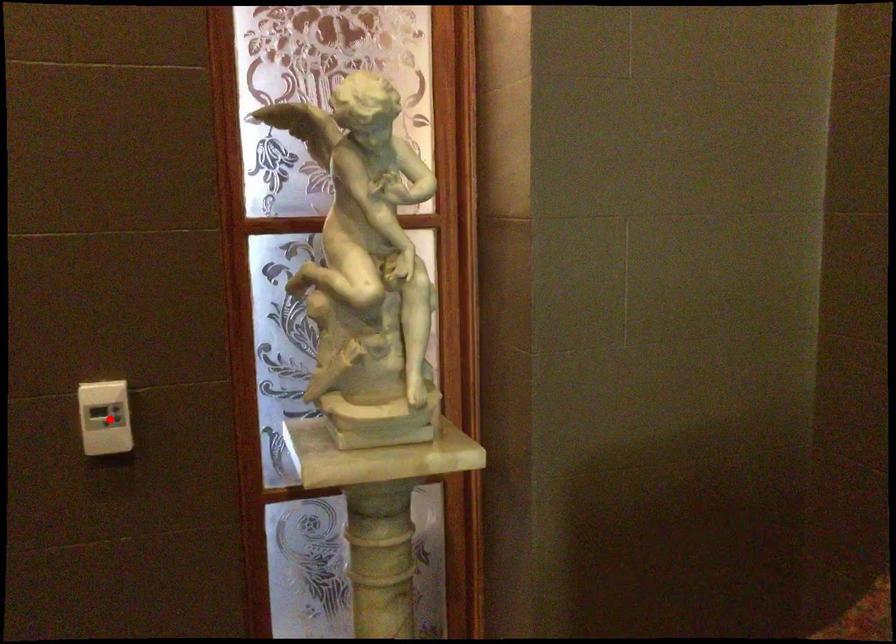
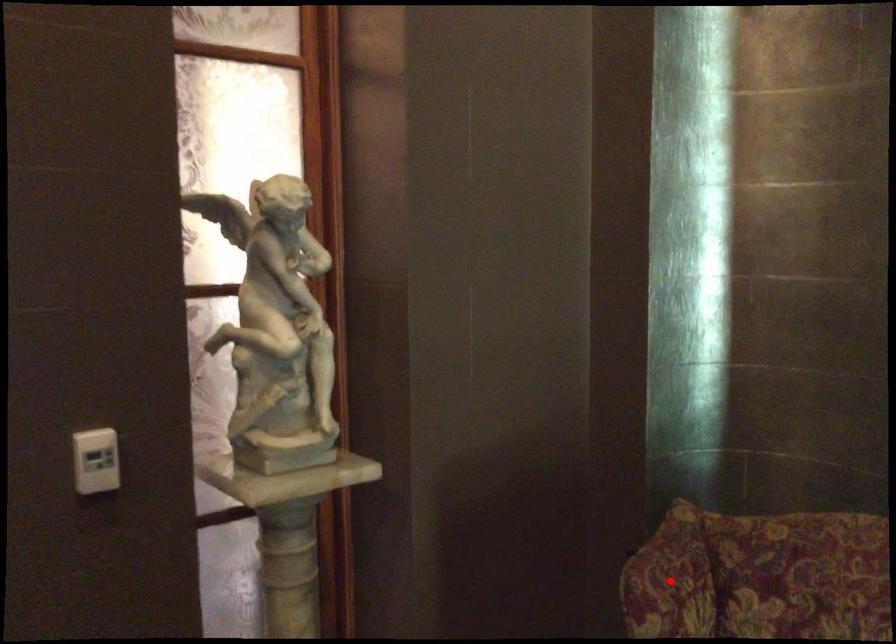
I am providing you with two images of the same scene from different viewpoints. A red point is marked on the first image and another point is marked on the second image. Are the points marked in image1 and image2 representing the same 3D position?

No